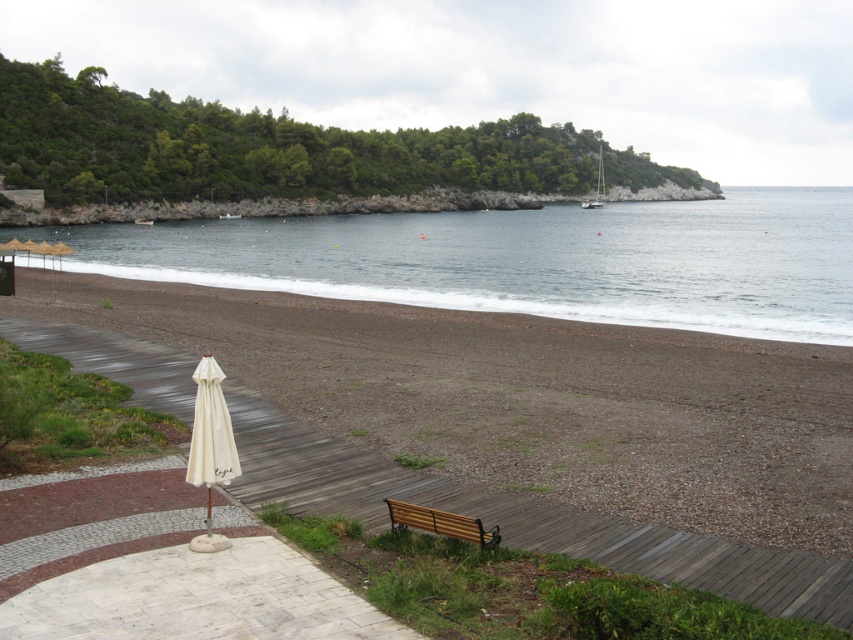
Question: Which point is closer to the camera?

Choices:
 (A) (419, 525)
 (B) (782, 516)
 (C) (202, 376)
 (D) (258, 268)

Answer: (C)

Question: Which object is the closest to the brown wooden bench at lower center?

Choices:
 (A) brown wooden bench at center
 (B) white fabric umbrella at lower left
 (C) blue water at center

Answer: (B)

Question: Can you confirm if brown wooden bench at center is wider than blue water at center?

Choices:
 (A) no
 (B) yes

Answer: (A)

Question: Does brown wooden bench at center have a greater width compared to blue water at center?

Choices:
 (A) yes
 (B) no

Answer: (B)

Question: Is brown wooden bench at center closer to the viewer compared to brown wooden bench at lower center?

Choices:
 (A) no
 (B) yes

Answer: (B)

Question: Which point is closer to the camera taking this photo?

Choices:
 (A) (810, 360)
 (B) (467, 538)
 (C) (830, 216)

Answer: (B)